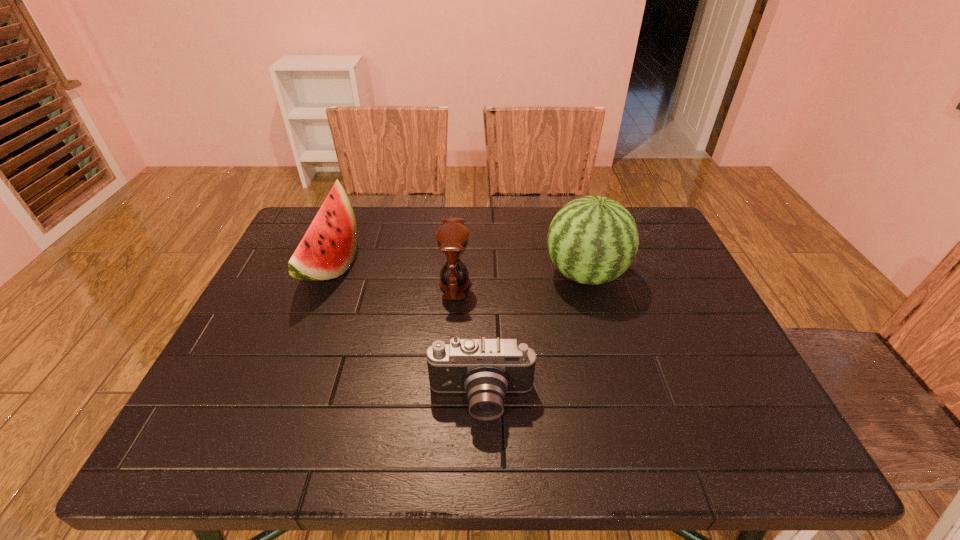
I want to click on object present at the near edge, so click(485, 369).

The height and width of the screenshot is (540, 960). Find the location of `object that is at the left edge`. object that is at the left edge is located at coordinates (328, 248).

The height and width of the screenshot is (540, 960). What are the coordinates of `object at the far left corner` in the screenshot? It's located at (328, 248).

Image resolution: width=960 pixels, height=540 pixels. I want to click on vacant space at the far edge, so click(x=546, y=249).

The height and width of the screenshot is (540, 960). What are the coordinates of `blank space at the near edge of the desktop` in the screenshot? It's located at (300, 420).

Locate an element on the screen. Image resolution: width=960 pixels, height=540 pixels. free region at the left edge of the desktop is located at coordinates (256, 363).

The width and height of the screenshot is (960, 540). In the image, there is a desktop. Find the location of `vacant space at the far right corner`. vacant space at the far right corner is located at coordinates (646, 225).

Image resolution: width=960 pixels, height=540 pixels. I want to click on vacant space at the near right corner of the desktop, so click(x=778, y=430).

Where is `vacant area that lies between the left watermelon and the hourglass`? The width and height of the screenshot is (960, 540). vacant area that lies between the left watermelon and the hourglass is located at coordinates (393, 275).

Where is `vacant space that is in between the rightmost object and the hourglass`? Image resolution: width=960 pixels, height=540 pixels. vacant space that is in between the rightmost object and the hourglass is located at coordinates (520, 279).